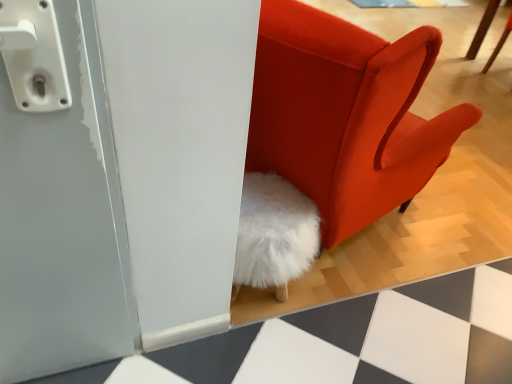
This screenshot has height=384, width=512. Identify the location of vacant area located to the right-hand side of velvet orange chair at center. 467,232.